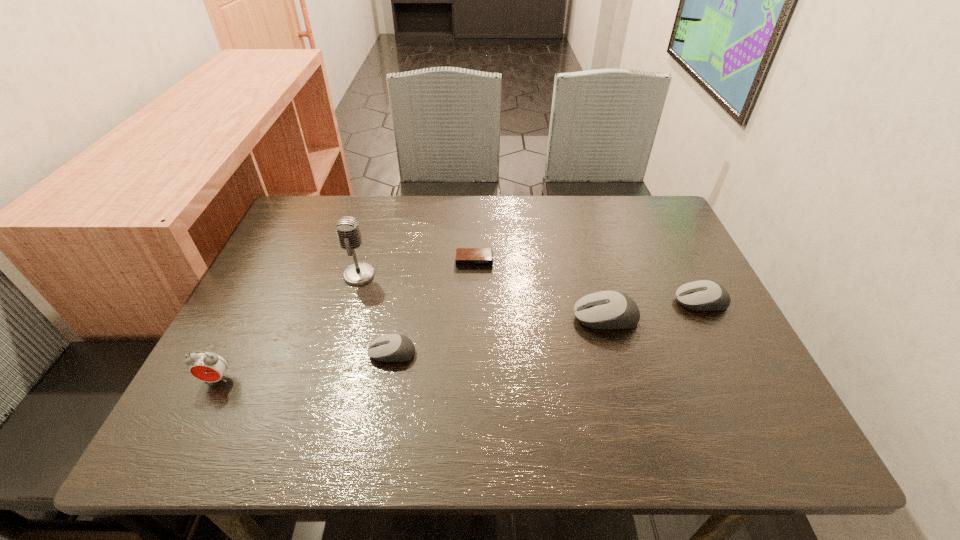
Where is `the fourth object from right to left`? The image size is (960, 540). the fourth object from right to left is located at coordinates (393, 347).

Find the location of a particular element. This screenshot has width=960, height=540. the second nearest object is located at coordinates (393, 347).

Find the location of a particular element. Image resolution: width=960 pixels, height=540 pixels. the second object from right to left is located at coordinates (607, 309).

What are the coordinates of `the fourth shortest object` in the screenshot? It's located at (607, 309).

Image resolution: width=960 pixels, height=540 pixels. In order to click on the fourth tallest object in this screenshot , I will do `click(703, 295)`.

Where is `the rightmost computer equipment`? Image resolution: width=960 pixels, height=540 pixels. the rightmost computer equipment is located at coordinates 703,295.

What are the coordinates of `microphone` in the screenshot? It's located at [347, 228].

Find the location of a particular element. This screenshot has height=540, width=960. the tallest object is located at coordinates (347, 228).

I want to click on the third object from right to left, so click(x=465, y=257).

In order to click on the shorter alarm clock in this screenshot , I will do `click(465, 257)`.